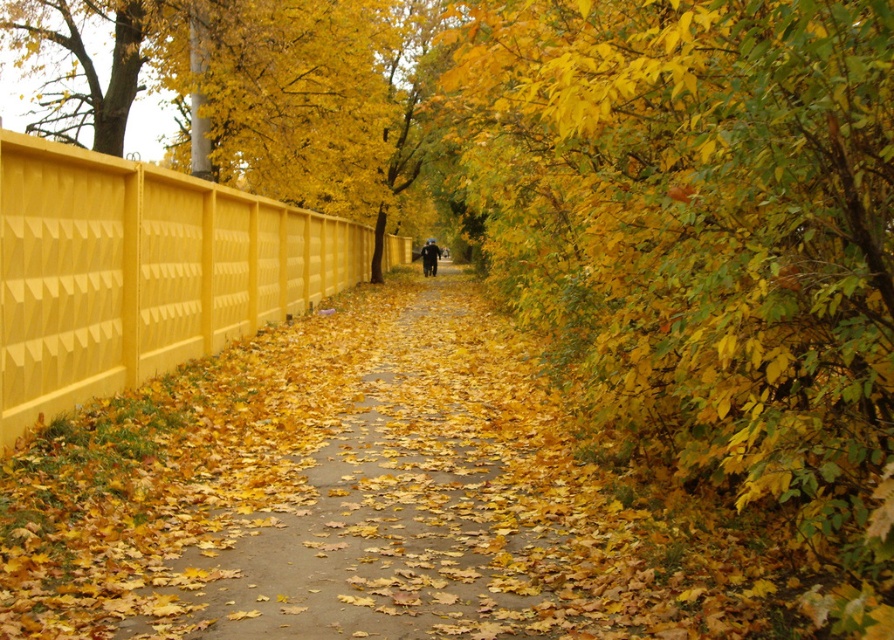
Question: Among these objects, which one is farthest from the camera?

Choices:
 (A) matte yellow fence at left
 (B) dark blue jacket at center

Answer: (B)

Question: Can you confirm if yellow concrete pavement at center is smaller than dark blue jacket at center?

Choices:
 (A) yes
 (B) no

Answer: (B)

Question: Which object is the farthest from the matte yellow fence at left?

Choices:
 (A) yellow concrete pavement at center
 (B) dark blue jacket at center

Answer: (B)

Question: Considering the relative positions of yellow concrete pavement at center and matte yellow fence at left in the image provided, where is yellow concrete pavement at center located with respect to matte yellow fence at left?

Choices:
 (A) above
 (B) below

Answer: (B)

Question: Is yellow concrete pavement at center to the right of matte yellow fence at left from the viewer's perspective?

Choices:
 (A) yes
 (B) no

Answer: (A)

Question: Estimate the real-world distances between objects in this image. Which object is closer to the matte yellow fence at left?

Choices:
 (A) dark blue jacket at center
 (B) yellow concrete pavement at center

Answer: (B)